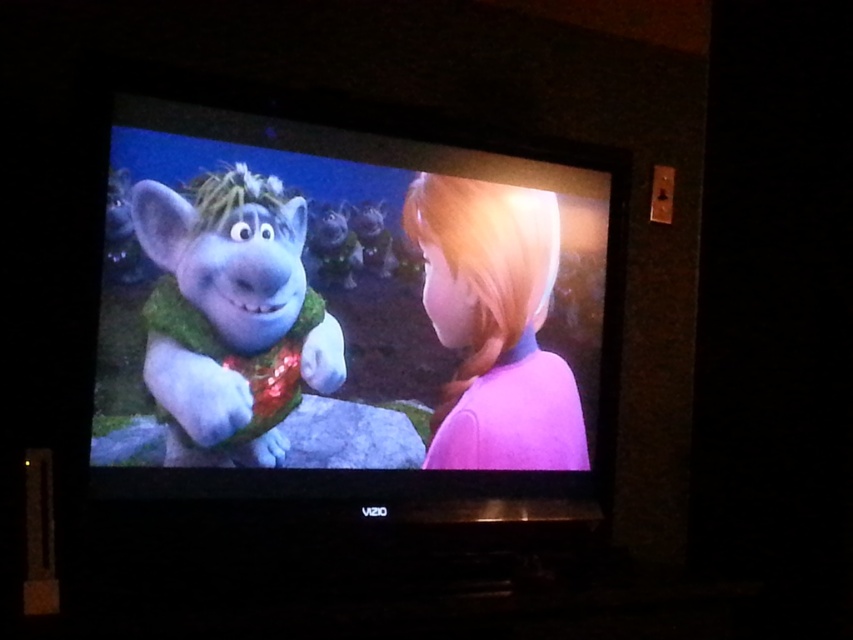
Question: Which point is closer to the camera taking this photo?

Choices:
 (A) coord(102,445)
 (B) coord(537,308)

Answer: (A)

Question: Can you confirm if fluffy green scarf at left is smaller than blonde hair at right?

Choices:
 (A) no
 (B) yes

Answer: (B)

Question: Which point is farther to the camera?

Choices:
 (A) blonde hair at right
 (B) shiny green fur at center

Answer: (A)

Question: Can you confirm if shiny green fur at center is positioned below fluffy green scarf at left?

Choices:
 (A) no
 (B) yes

Answer: (A)

Question: Which object is closer to the camera taking this photo?

Choices:
 (A) fluffy green scarf at left
 (B) blonde hair at right

Answer: (A)

Question: Is fluffy green scarf at left smaller than blonde hair at right?

Choices:
 (A) no
 (B) yes

Answer: (B)